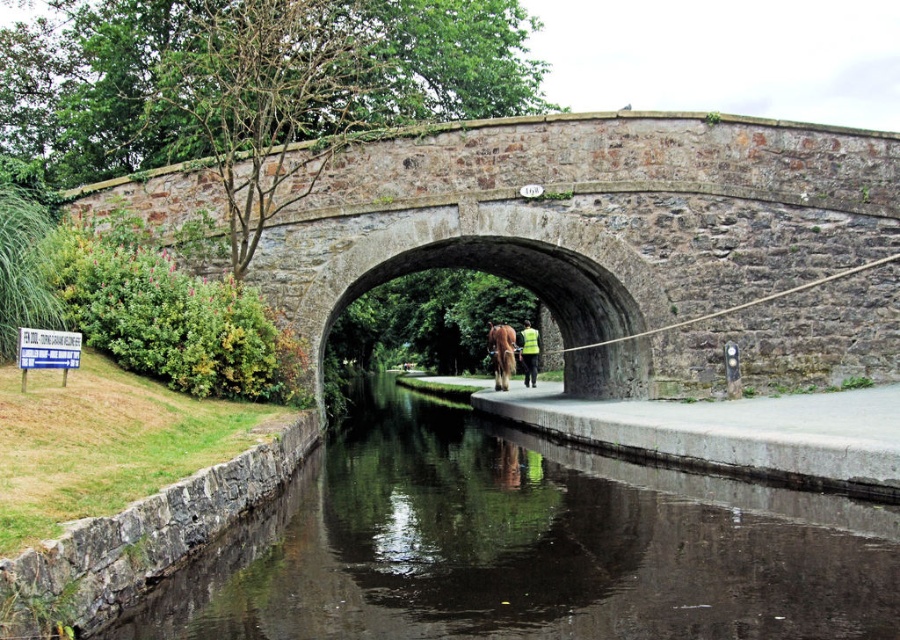
Find the location of a particular element. The height and width of the screenshot is (640, 900). stone archway at center is located at coordinates (462, 308).

Is point (509, 310) positioned before point (789, 417)?

That is False.

Where is `stone archway at center`? The image size is (900, 640). stone archway at center is located at coordinates (462, 308).

Between rustic stone bridge at center and dark reflective water at center, which one has less height?

dark reflective water at center is shorter.

In the scene shown: Does rustic stone bridge at center lie in front of dark reflective water at center?

No, rustic stone bridge at center is further to the viewer.

Is point (631, 186) positioned before point (441, 566)?

No.

Where is `rustic stone bridge at center`? rustic stone bridge at center is located at coordinates pos(621,241).

Which is more to the right, stone archway at center or yellow reflective vest at center?

yellow reflective vest at center is more to the right.

What are the coordinates of `stone archway at center` in the screenshot? It's located at (462, 308).